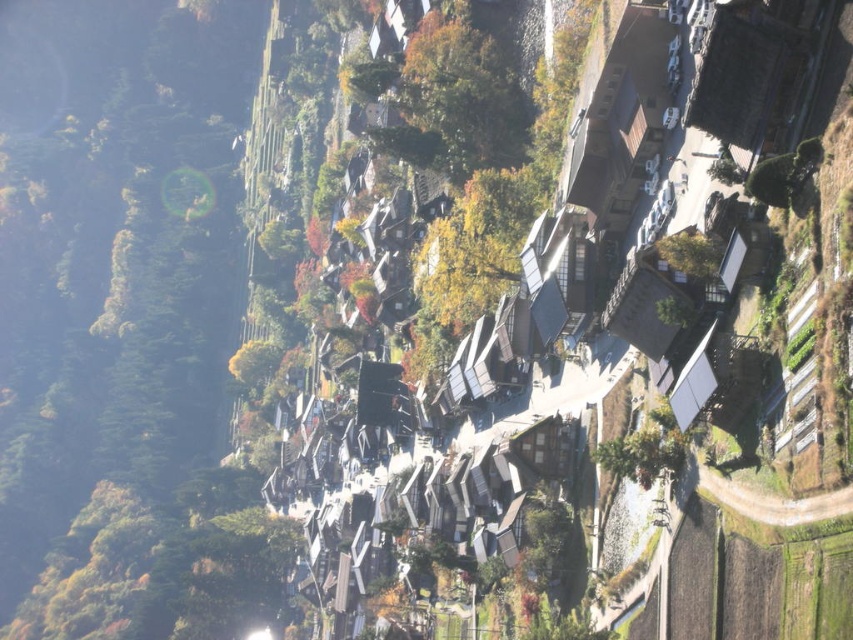
You are an artist planning to paint the village scene. You notice the green matte tree at upper center and the green leafy tree at upper right. Which tree should you paint first if you want to follow the standard painting technique of starting with the background elements first?

The green matte tree at upper center should be painted first because it is positioned above the green leafy tree at upper right, making it part of the background layer in the scene.

You are standing at the entrance of the village and notice a green matte tree at upper center. Based on its coordinates, can you determine if it is positioned closer to the top or bottom of the image?

The green matte tree at upper center is located at point coordinates where the y value is 0.542. Since the coordinate system likely places 0 at the bottom and 1 at the top, a y value of 0.542 places it closer to the top of the image.